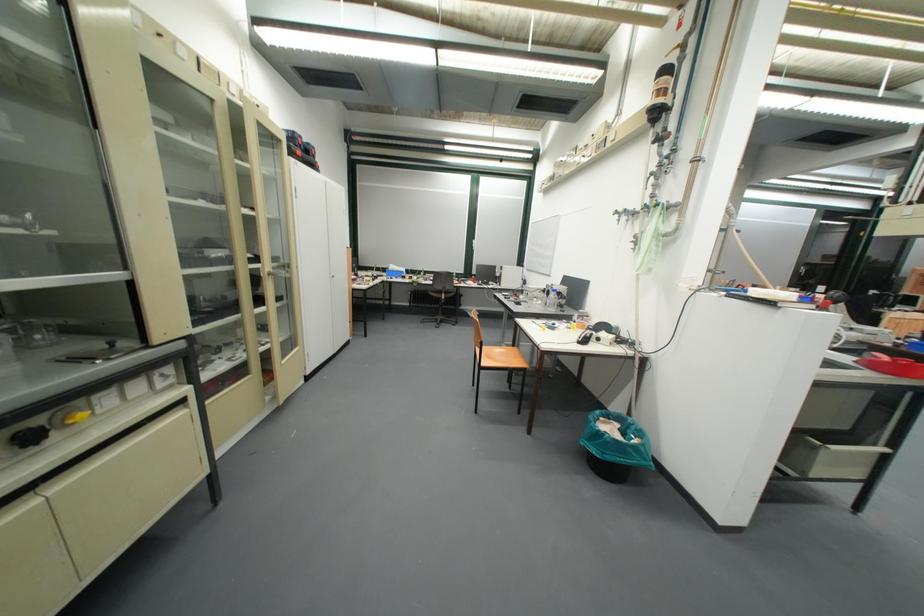
I want to click on black chair surface, so click(x=441, y=293).